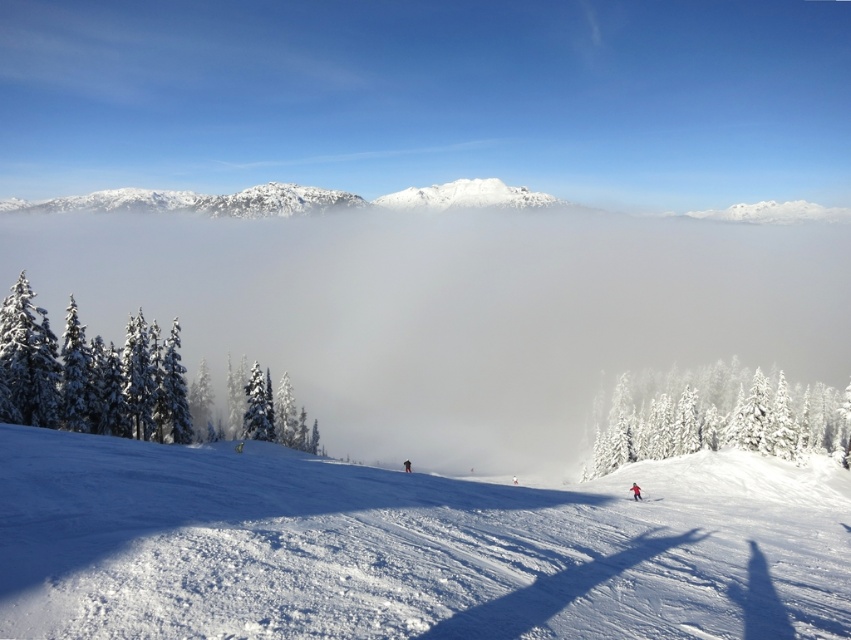
You are a skier planning to descend the slope. The point at coordinates (386,552) marks the white snow ski slope at center. Is this the steepest part of the slope?

The point at coordinates (386,552) indicates the white snow ski slope at center. Since the slope is described as gently sloping, this area is not the steepest part of the slope.

You are a skier preparing to descend the white snow ski slope at center. You notice the red matte ski at lower right. From your perspective on the slope, where is the red matte ski located relative to you?

The red matte ski at lower right is located below you because the white snow ski slope at center is positioned over it.